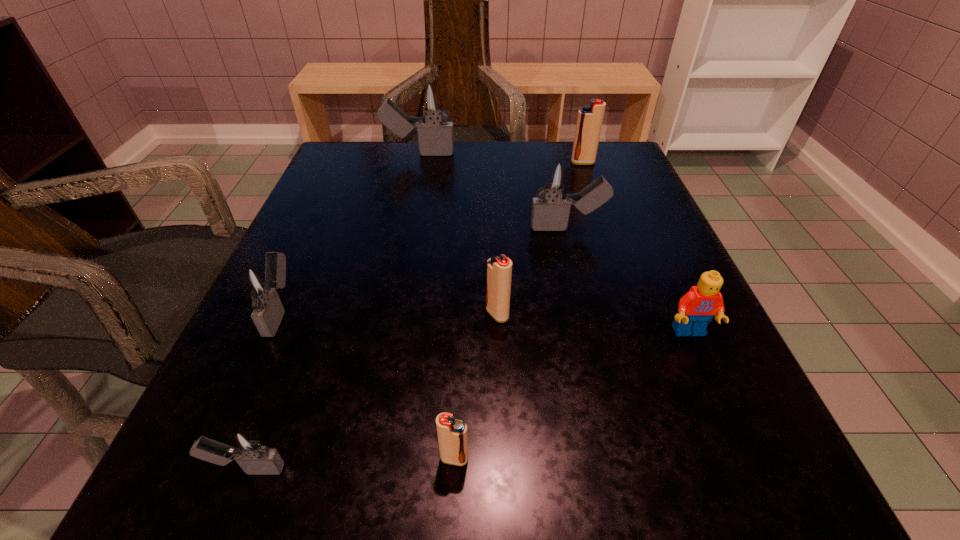
Where is `the biggest gray igniter`? The height and width of the screenshot is (540, 960). the biggest gray igniter is located at coordinates (432, 100).

Image resolution: width=960 pixels, height=540 pixels. What are the coordinates of `the tallest object` in the screenshot? It's located at point(432,100).

At what (x,y) coordinates should I click in order to perform the action: click on the rightmost red igniter. Please return your answer as a coordinate pair (x, y). Looking at the image, I should click on (589, 122).

The image size is (960, 540). I want to click on the farthest red igniter, so click(x=589, y=122).

At what (x,y) coordinates should I click in order to perform the action: click on the sixth nearest object. Please return your answer as a coordinate pair (x, y). Looking at the image, I should click on (554, 178).

Where is `the third farthest igniter`? This screenshot has width=960, height=540. the third farthest igniter is located at coordinates (554, 178).

Identify the location of the second smallest gray igniter. (260, 285).

Where is `the third igniter from right to left`? This screenshot has height=540, width=960. the third igniter from right to left is located at coordinates (499, 269).

You are a GUI agent. You are given a task and a screenshot of the screen. Output one action in this format:
    pyautogui.click(x=<x>, y=<y>)
    Task: Click on the second nearest red igniter
    
    Given the screenshot: What is the action you would take?
    pyautogui.click(x=499, y=269)

Identify the location of the rightmost object. (697, 307).